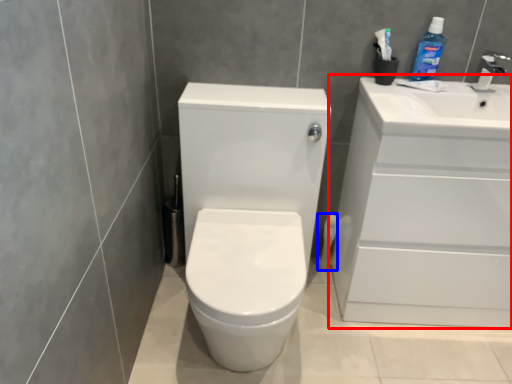
Question: Which point is closer to the camera, bathroom cabinet (highlighted by a red box) or toilet paper (highlighted by a blue box)?

Choices:
 (A) bathroom cabinet
 (B) toilet paper

Answer: (A)